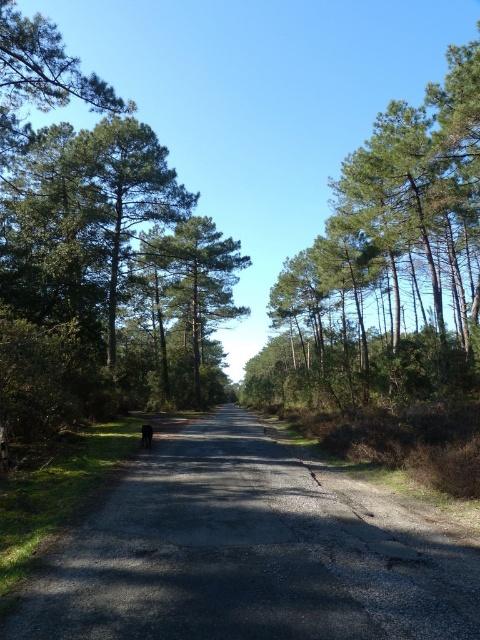
Does dirt road at center have a lesser width compared to green matte tree at center?

Yes.

Is point (235, 616) farther from camera compared to point (142, 250)?

That is False.

Is point (369, 493) positioned in front of point (182, 397)?

Yes, it is.

Identify the location of dirt road at center. This screenshot has width=480, height=640. (251, 552).

Is green leafy tree at upper right further to the viewer compared to green matte tree at center?

No, green leafy tree at upper right is closer to the viewer.

The image size is (480, 640). What do you see at coordinates (388, 266) in the screenshot?
I see `green leafy tree at upper right` at bounding box center [388, 266].

Is point (388, 324) less distant than point (189, 234)?

No, it is not.

Locate an element on the screen. Image resolution: width=480 pixels, height=640 pixels. green leafy tree at upper right is located at coordinates (388, 266).

Can you confirm if dirt road at center is positioned to the left of green leafy tree at upper right?

Correct, you'll find dirt road at center to the left of green leafy tree at upper right.

This screenshot has width=480, height=640. I want to click on dirt road at center, so click(251, 552).